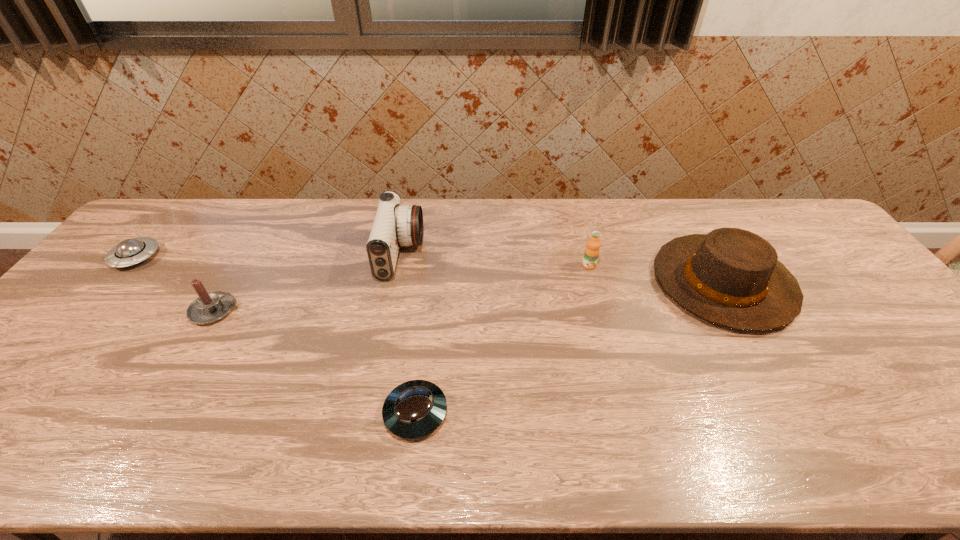
The image size is (960, 540). I want to click on camcorder, so click(394, 225).

Where is `the rightmost object`? Image resolution: width=960 pixels, height=540 pixels. the rightmost object is located at coordinates (731, 277).

Where is `orange juice`? orange juice is located at coordinates (592, 250).

In order to click on candle in this screenshot , I will do `click(208, 308)`.

Where is `the second shortest object`? The height and width of the screenshot is (540, 960). the second shortest object is located at coordinates (128, 252).

The height and width of the screenshot is (540, 960). What are the coordinates of `the farther saucer` in the screenshot? It's located at (128, 252).

Find the location of a particular element. The width and height of the screenshot is (960, 540). the right saucer is located at coordinates (414, 409).

In order to click on the shorter saucer in this screenshot , I will do `click(414, 409)`.

Where is `free space located 0.200m on the surface of the camcorder`? Image resolution: width=960 pixels, height=540 pixels. free space located 0.200m on the surface of the camcorder is located at coordinates (487, 254).

Where is `vacant space located on the left of the cowboy hat`? This screenshot has width=960, height=540. vacant space located on the left of the cowboy hat is located at coordinates (558, 283).